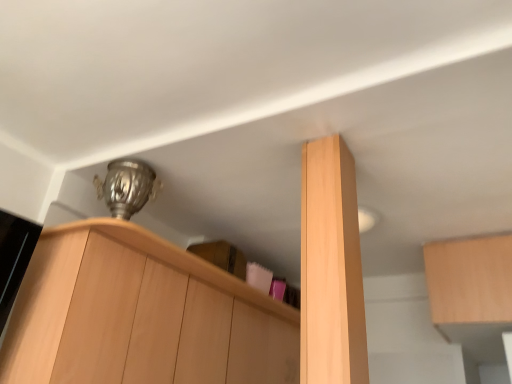
At what (x,y) coordinates should I click in order to perform the action: click on light wood cabinet at upper right, the first cabinetry positioned from the right. Please return your answer as a coordinate pair (x, y). This screenshot has height=384, width=512. Looking at the image, I should click on (470, 280).

From the image's perspective, relative to light wood cabinet at upper left, the first cabinetry viewed from the left, is light wood cabinet at upper right, the first cabinetry positioned from the right, above or below?

From the image's perspective, light wood cabinet at upper right, the first cabinetry positioned from the right, appears above light wood cabinet at upper left, the first cabinetry viewed from the left.

In the image, is light wood cabinet at upper right, the first cabinetry positioned from the right, on the left side or the right side of light wood cabinet at upper left, the first cabinetry viewed from the left?

From the image, it's evident that light wood cabinet at upper right, the first cabinetry positioned from the right, is to the right of light wood cabinet at upper left, the first cabinetry viewed from the left.

Is light wood cabinet at upper right, placed as the 3th cabinetry when sorted from left to right, positioned with its back to light wood cabinet at upper left, the first cabinetry viewed from the left?

No, light wood cabinet at upper right, placed as the 3th cabinetry when sorted from left to right, is not facing the opposite direction of light wood cabinet at upper left, the first cabinetry viewed from the left.

Considering the positions of point (475, 246) and point (167, 368), is point (475, 246) closer or farther from the camera than point (167, 368)?

Clearly, point (475, 246) is more distant from the camera than point (167, 368).

Does light wood cabinet at center, the second cabinetry when ordered from right to left, have a smaller size compared to light wood cabinet at upper left, the first cabinetry viewed from the left?

Yes.

Does point (355, 310) appear closer or farther from the camera than point (75, 329)?

Point (355, 310) appears to be closer to the viewer than point (75, 329).

Between light wood cabinet at center, acting as the second cabinetry starting from the left, and light wood cabinet at upper left, the first cabinetry viewed from the left, which one appears on the left side from the viewer's perspective?

light wood cabinet at upper left, the first cabinetry viewed from the left.

Can you confirm if light wood cabinet at center, the second cabinetry when ordered from right to left, is shorter than light wood cabinet at upper left, which is the 3th cabinetry in right-to-left order?

No, light wood cabinet at center, the second cabinetry when ordered from right to left, is not shorter than light wood cabinet at upper left, which is the 3th cabinetry in right-to-left order.

Considering the relative positions of light wood cabinet at center, acting as the second cabinetry starting from the left, and light wood cabinet at upper right, the first cabinetry positioned from the right, in the image provided, is light wood cabinet at center, acting as the second cabinetry starting from the left, to the left of light wood cabinet at upper right, the first cabinetry positioned from the right, from the viewer's perspective?

Yes, light wood cabinet at center, acting as the second cabinetry starting from the left, is to the left of light wood cabinet at upper right, the first cabinetry positioned from the right.

From the picture: Between light wood cabinet at center, the second cabinetry when ordered from right to left, and light wood cabinet at upper right, the first cabinetry positioned from the right, which one has smaller width?

Thinner between the two is light wood cabinet at center, the second cabinetry when ordered from right to left.

Considering their positions, is light wood cabinet at center, acting as the second cabinetry starting from the left, located in front of or behind light wood cabinet at upper right, placed as the 3th cabinetry when sorted from left to right?

light wood cabinet at center, acting as the second cabinetry starting from the left, is positioned closer to the viewer than light wood cabinet at upper right, placed as the 3th cabinetry when sorted from left to right.

Do you think light wood cabinet at center, acting as the second cabinetry starting from the left, is within light wood cabinet at upper right, placed as the 3th cabinetry when sorted from left to right, or outside of it?

light wood cabinet at center, acting as the second cabinetry starting from the left, is not inside light wood cabinet at upper right, placed as the 3th cabinetry when sorted from left to right, it's outside.

How many degrees apart are the facing directions of light wood cabinet at upper left, which is the 3th cabinetry in right-to-left order, and light wood cabinet at upper right, the first cabinetry positioned from the right?

88.4 degrees.

Where is `the 2nd cabinetry located above the light wood cabinet at upper left, the first cabinetry viewed from the left (from a real-world perspective)`? the 2nd cabinetry located above the light wood cabinet at upper left, the first cabinetry viewed from the left (from a real-world perspective) is located at coordinates (470, 280).

Is light wood cabinet at upper left, which is the 3th cabinetry in right-to-left order, not within light wood cabinet at upper right, the first cabinetry positioned from the right?

Yes, light wood cabinet at upper left, which is the 3th cabinetry in right-to-left order, is located beyond the bounds of light wood cabinet at upper right, the first cabinetry positioned from the right.

Does light wood cabinet at upper left, which is the 3th cabinetry in right-to-left order, appear on the right side of light wood cabinet at upper right, placed as the 3th cabinetry when sorted from left to right?

No, light wood cabinet at upper left, which is the 3th cabinetry in right-to-left order, is not to the right of light wood cabinet at upper right, placed as the 3th cabinetry when sorted from left to right.

Is the depth of light wood cabinet at upper right, the first cabinetry positioned from the right, less than that of light wood cabinet at center, acting as the second cabinetry starting from the left?

No, light wood cabinet at upper right, the first cabinetry positioned from the right, is further to the viewer.

Find the location of a particular element. The height and width of the screenshot is (384, 512). cabinetry to the right of light wood cabinet at center, acting as the second cabinetry starting from the left is located at coordinates (470, 280).

Is light wood cabinet at upper right, placed as the 3th cabinetry when sorted from left to right, not near light wood cabinet at center, acting as the second cabinetry starting from the left?

Yes, light wood cabinet at upper right, placed as the 3th cabinetry when sorted from left to right, and light wood cabinet at center, acting as the second cabinetry starting from the left, are located far from each other.

Which object is thinner, light wood cabinet at upper right, placed as the 3th cabinetry when sorted from left to right, or light wood cabinet at center, acting as the second cabinetry starting from the left?

Thinner between the two is light wood cabinet at center, acting as the second cabinetry starting from the left.

Which object is more forward, light wood cabinet at upper left, which is the 3th cabinetry in right-to-left order, or light wood cabinet at center, acting as the second cabinetry starting from the left?

Positioned in front is light wood cabinet at center, acting as the second cabinetry starting from the left.

Is light wood cabinet at upper left, which is the 3th cabinetry in right-to-left order, facing away from light wood cabinet at center, the second cabinetry when ordered from right to left?

No, light wood cabinet at center, the second cabinetry when ordered from right to left, is not at the back of light wood cabinet at upper left, which is the 3th cabinetry in right-to-left order.

What's the angular difference between light wood cabinet at upper left, which is the 3th cabinetry in right-to-left order, and light wood cabinet at center, the second cabinetry when ordered from right to left,'s facing directions?

7.45 degrees separate the facing orientations of light wood cabinet at upper left, which is the 3th cabinetry in right-to-left order, and light wood cabinet at center, the second cabinetry when ordered from right to left.

Who is bigger, light wood cabinet at upper left, the first cabinetry viewed from the left, or light wood cabinet at center, acting as the second cabinetry starting from the left?

light wood cabinet at upper left, the first cabinetry viewed from the left.

From the image's perspective, starting from the light wood cabinet at upper left, which is the 3th cabinetry in right-to-left order, which cabinetry is the 1st one above? Please provide its 2D coordinates.

[(470, 280)]

Starting from the light wood cabinet at center, the second cabinetry when ordered from right to left, which cabinetry is the 1st one behind? Please provide its 2D coordinates.

[(193, 302)]

Estimate the real-world distances between objects in this image. Which object is further from light wood cabinet at upper right, the first cabinetry positioned from the right, light wood cabinet at center, the second cabinetry when ordered from right to left, or light wood cabinet at upper left, the first cabinetry viewed from the left?

light wood cabinet at upper left, the first cabinetry viewed from the left, is positioned further to the anchor light wood cabinet at upper right, the first cabinetry positioned from the right.

When comparing their distances from light wood cabinet at center, the second cabinetry when ordered from right to left, does light wood cabinet at upper left, which is the 3th cabinetry in right-to-left order, or light wood cabinet at upper right, the first cabinetry positioned from the right, seem further?

light wood cabinet at upper right, the first cabinetry positioned from the right, is positioned further to the anchor light wood cabinet at center, the second cabinetry when ordered from right to left.

Based on their spatial positions, is light wood cabinet at upper left, the first cabinetry viewed from the left, or light wood cabinet at center, acting as the second cabinetry starting from the left, further from light wood cabinet at upper right, placed as the 3th cabinetry when sorted from left to right?

Among the two, light wood cabinet at upper left, the first cabinetry viewed from the left, is located further to light wood cabinet at upper right, placed as the 3th cabinetry when sorted from left to right.

Based on their spatial positions, is light wood cabinet at center, the second cabinetry when ordered from right to left, or light wood cabinet at upper right, the first cabinetry positioned from the right, further from light wood cabinet at upper left, the first cabinetry viewed from the left?

light wood cabinet at upper right, the first cabinetry positioned from the right.

When comparing their distances from light wood cabinet at center, the second cabinetry when ordered from right to left, does light wood cabinet at upper right, placed as the 3th cabinetry when sorted from left to right, or light wood cabinet at upper left, the first cabinetry viewed from the left, seem further?

light wood cabinet at upper right, placed as the 3th cabinetry when sorted from left to right, is further to light wood cabinet at center, the second cabinetry when ordered from right to left.

Looking at the image, which one is located closer to light wood cabinet at upper left, which is the 3th cabinetry in right-to-left order, light wood cabinet at upper right, placed as the 3th cabinetry when sorted from left to right, or light wood cabinet at center, the second cabinetry when ordered from right to left?

light wood cabinet at center, the second cabinetry when ordered from right to left, is positioned closer to the anchor light wood cabinet at upper left, which is the 3th cabinetry in right-to-left order.

At what (x,y) coordinates should I click in order to perform the action: click on cabinetry between light wood cabinet at upper left, which is the 3th cabinetry in right-to-left order, and light wood cabinet at upper right, placed as the 3th cabinetry when sorted from left to right, in the horizontal direction. Please return your answer as a coordinate pair (x, y). This screenshot has width=512, height=384. Looking at the image, I should click on (331, 268).